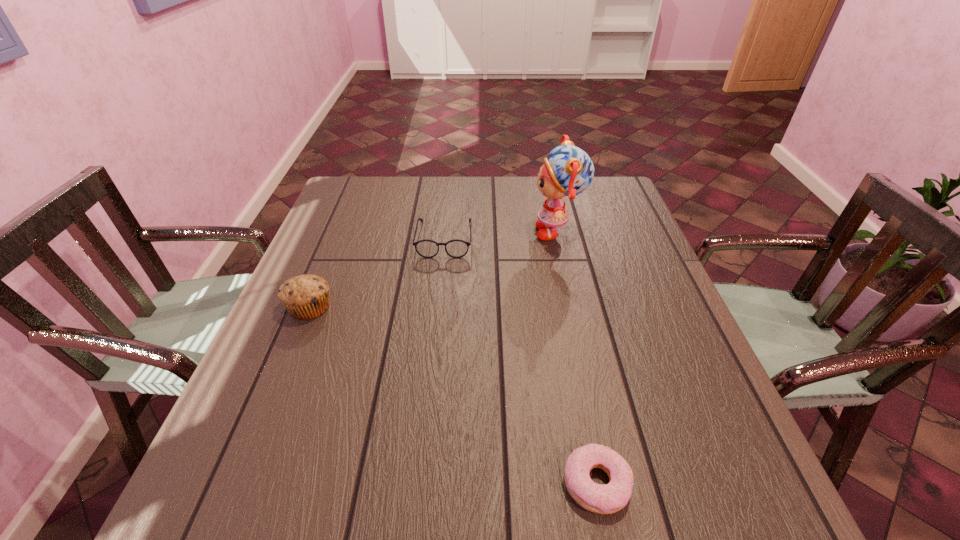
In order to click on vacant space located on the front of the second tallest object in this screenshot , I will do `click(276, 387)`.

I want to click on vacant region located 0.070m on the front-facing side of the spectacles, so click(441, 275).

Identify the location of vacant space located 0.360m on the back of the shortest object. The image size is (960, 540). (562, 306).

Locate an element on the screen. object at the far edge is located at coordinates click(568, 171).

At what (x,y) coordinates should I click in order to perform the action: click on object situated at the near edge. Please return your answer as a coordinate pair (x, y). The width and height of the screenshot is (960, 540). Looking at the image, I should click on (603, 499).

Locate an element on the screen. This screenshot has height=540, width=960. object present at the left edge is located at coordinates (305, 297).

Locate an element on the screen. vacant space at the far edge of the desktop is located at coordinates (416, 185).

At what (x,y) coordinates should I click in order to perform the action: click on free space at the near edge of the desktop. Please return your answer as a coordinate pair (x, y). This screenshot has height=540, width=960. Looking at the image, I should click on 609,521.

In the image, there is a desktop. Identify the location of free space at the left edge. (377, 221).

In the image, there is a desktop. Where is `vacant space at the right edge`? vacant space at the right edge is located at coordinates (602, 224).